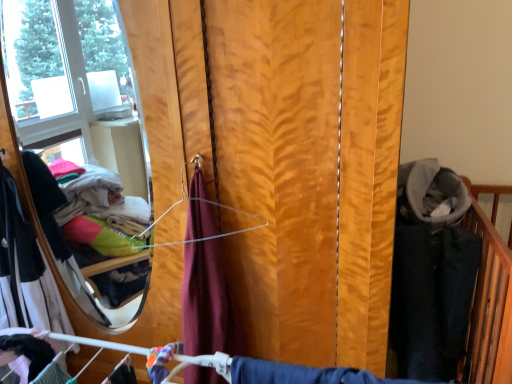
Locate an element on the screen. wooden blinds at center is located at coordinates [x=310, y=170].

Describe the element at coordinates (25, 270) in the screenshot. The height and width of the screenshot is (384, 512). I see `white cotton dress at left, acting as the second clothing starting from the right` at that location.

Identify the location of matte black fabric at lower left, which ranks as the 1th clothing in right-to-left order. The height and width of the screenshot is (384, 512). (35, 358).

From the image's perspective, starting from the wooden blinds at center, which clothing is the 2nd one below? Please provide its 2D coordinates.

[(35, 358)]

From the image's perspective, which one is positioned lower, matte black fabric at lower left, which ranks as the 1th clothing in right-to-left order, or wooden blinds at center?

matte black fabric at lower left, which ranks as the 1th clothing in right-to-left order, is shown below in the image.

From a real-world perspective, who is located lower, matte black fabric at lower left, the second clothing positioned from the back, or wooden blinds at center?

matte black fabric at lower left, the second clothing positioned from the back.

Who is smaller, matte black fabric at lower left, the second clothing in the left-to-right sequence, or wooden blinds at center?

With smaller size is matte black fabric at lower left, the second clothing in the left-to-right sequence.

From a real-world perspective, which is physically below, wooden blinds at center or white cotton dress at left, the second clothing positioned from the front?

white cotton dress at left, the second clothing positioned from the front.

Could you tell me if wooden blinds at center is facing white cotton dress at left, acting as the second clothing starting from the right?

Yes, wooden blinds at center is turned towards white cotton dress at left, acting as the second clothing starting from the right.

Which object is further away from the camera taking this photo, wooden blinds at center or white cotton dress at left, the second clothing positioned from the front?

Positioned behind is white cotton dress at left, the second clothing positioned from the front.

Could you tell me if white cotton dress at left, the second clothing positioned from the front, is turned towards wooden blinds at center?

No, white cotton dress at left, the second clothing positioned from the front, does not turn towards wooden blinds at center.

I want to click on curtain that is above the white cotton dress at left, acting as the second clothing starting from the right (from a real-world perspective), so (310, 170).

Considering the relative positions of white cotton dress at left, which ranks as the 1th clothing in left-to-right order, and wooden blinds at center in the image provided, is white cotton dress at left, which ranks as the 1th clothing in left-to-right order, to the right of wooden blinds at center from the viewer's perspective?

No, white cotton dress at left, which ranks as the 1th clothing in left-to-right order, is not to the right of wooden blinds at center.

From the image's perspective, is white cotton dress at left, which ranks as the 1th clothing in left-to-right order, above or below wooden blinds at center?

Clearly, from the image's perspective, white cotton dress at left, which ranks as the 1th clothing in left-to-right order, is below wooden blinds at center.

Would you consider matte black fabric at lower left, which ranks as the 1th clothing in right-to-left order, to be distant from white cotton dress at left, the first clothing from the back?

No, matte black fabric at lower left, which ranks as the 1th clothing in right-to-left order, is not far away from white cotton dress at left, the first clothing from the back.

Is point (42, 362) closer to viewer compared to point (8, 258)?

Yes, point (42, 362) is in front of point (8, 258).

From the image's perspective, is matte black fabric at lower left, the second clothing positioned from the back, located beneath white cotton dress at left, acting as the second clothing starting from the right?

Yes.

Which object is thinner, matte black fabric at lower left, which ranks as the 1th clothing in right-to-left order, or white cotton dress at left, the second clothing positioned from the front?

With smaller width is matte black fabric at lower left, which ranks as the 1th clothing in right-to-left order.

From the picture: From the image's perspective, is white cotton dress at left, the second clothing positioned from the front, above or below matte black fabric at lower left, the second clothing in the left-to-right sequence?

white cotton dress at left, the second clothing positioned from the front, is situated higher than matte black fabric at lower left, the second clothing in the left-to-right sequence, in the image.

Could you measure the distance between white cotton dress at left, which ranks as the 1th clothing in left-to-right order, and matte black fabric at lower left, the second clothing positioned from the back?

white cotton dress at left, which ranks as the 1th clothing in left-to-right order, and matte black fabric at lower left, the second clothing positioned from the back, are 23.78 inches apart from each other.

Find the location of a particular element. clothing directly beneath the white cotton dress at left, the second clothing positioned from the front (from a real-world perspective) is located at coordinates (35, 358).

Which is in front, white cotton dress at left, which ranks as the 1th clothing in left-to-right order, or matte black fabric at lower left, which ranks as the 1th clothing in right-to-left order?

matte black fabric at lower left, which ranks as the 1th clothing in right-to-left order, is in front.

Is wooden blinds at center far away from matte black fabric at lower left, the second clothing in the left-to-right sequence?

wooden blinds at center is near matte black fabric at lower left, the second clothing in the left-to-right sequence, not far away.

Which is farther, (168, 43) or (52, 349)?

Point (168, 43)

In the scene shown: Is wooden blinds at center at the right side of matte black fabric at lower left, which ranks as the 1th clothing in right-to-left order?

Yes, wooden blinds at center is to the right of matte black fabric at lower left, which ranks as the 1th clothing in right-to-left order.

There is a wooden blinds at center. Identify the location of the 2nd clothing below it (from a real-world perspective). The image size is (512, 384). (35, 358).

From the image's perspective, which clothing is the 1st one below the wooden blinds at center? Please provide its 2D coordinates.

[(25, 270)]

Considering their positions, is wooden blinds at center positioned further to white cotton dress at left, the first clothing from the back, than matte black fabric at lower left, marked as the 1th clothing in a front-to-back arrangement?

wooden blinds at center.

From the picture: Estimate the real-world distances between objects in this image. Which object is closer to white cotton dress at left, the second clothing positioned from the front, matte black fabric at lower left, marked as the 1th clothing in a front-to-back arrangement, or wooden blinds at center?

matte black fabric at lower left, marked as the 1th clothing in a front-to-back arrangement, is closer to white cotton dress at left, the second clothing positioned from the front.

Based on their spatial positions, is matte black fabric at lower left, which ranks as the 1th clothing in right-to-left order, or white cotton dress at left, the second clothing positioned from the front, further from wooden blinds at center?

white cotton dress at left, the second clothing positioned from the front, is further to wooden blinds at center.

Based on their spatial positions, is white cotton dress at left, which ranks as the 1th clothing in left-to-right order, or matte black fabric at lower left, marked as the 1th clothing in a front-to-back arrangement, further from wooden blinds at center?

Based on the image, white cotton dress at left, which ranks as the 1th clothing in left-to-right order, appears to be further to wooden blinds at center.

Based on their spatial positions, is wooden blinds at center or white cotton dress at left, the second clothing positioned from the front, closer to matte black fabric at lower left, marked as the 1th clothing in a front-to-back arrangement?

white cotton dress at left, the second clothing positioned from the front, lies closer to matte black fabric at lower left, marked as the 1th clothing in a front-to-back arrangement, than the other object.

Looking at the image, which one is located further to matte black fabric at lower left, which ranks as the 1th clothing in right-to-left order, white cotton dress at left, the first clothing from the back, or wooden blinds at center?

wooden blinds at center lies further to matte black fabric at lower left, which ranks as the 1th clothing in right-to-left order, than the other object.

This screenshot has width=512, height=384. I want to click on curtain between matte black fabric at lower left, the second clothing positioned from the back, and white cotton dress at left, the first clothing from the back, along the z-axis, so click(310, 170).